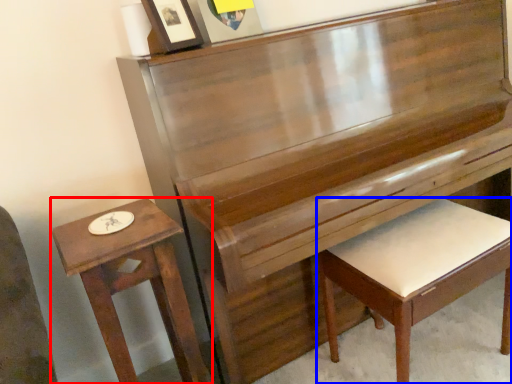
Question: Which object is closer to the camera taking this photo, table (highlighted by a red box) or furniture (highlighted by a blue box)?

Choices:
 (A) table
 (B) furniture

Answer: (A)